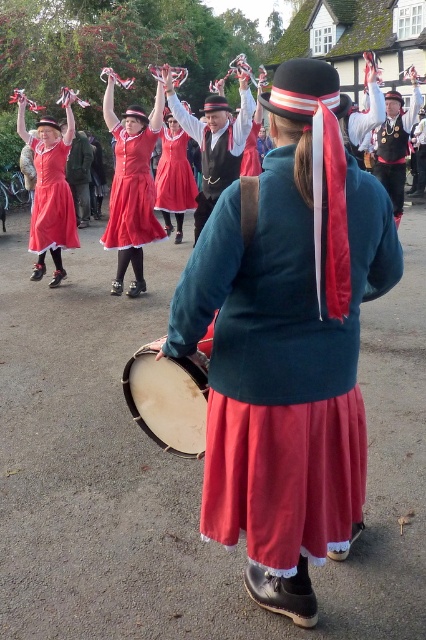
Question: Is matte red dress at left above matte red dress at center?

Choices:
 (A) yes
 (B) no

Answer: (B)

Question: Considering the real-world distances, which object is farthest from the matte red dress at upper center?

Choices:
 (A) light brown drum at center
 (B) matte red dress at left

Answer: (A)

Question: Does matte red dress at upper center have a smaller size compared to light brown drum at center?

Choices:
 (A) no
 (B) yes

Answer: (A)

Question: Which point is farther from the camera taking this photo?

Choices:
 (A) (54, 131)
 (B) (144, 397)

Answer: (A)

Question: In this image, where is matte teal jacket at center located relative to light brown drum at center?

Choices:
 (A) above
 (B) below

Answer: (A)

Question: Which point appears closest to the camera in this image?

Choices:
 (A) (154, 129)
 (B) (195, 353)

Answer: (B)